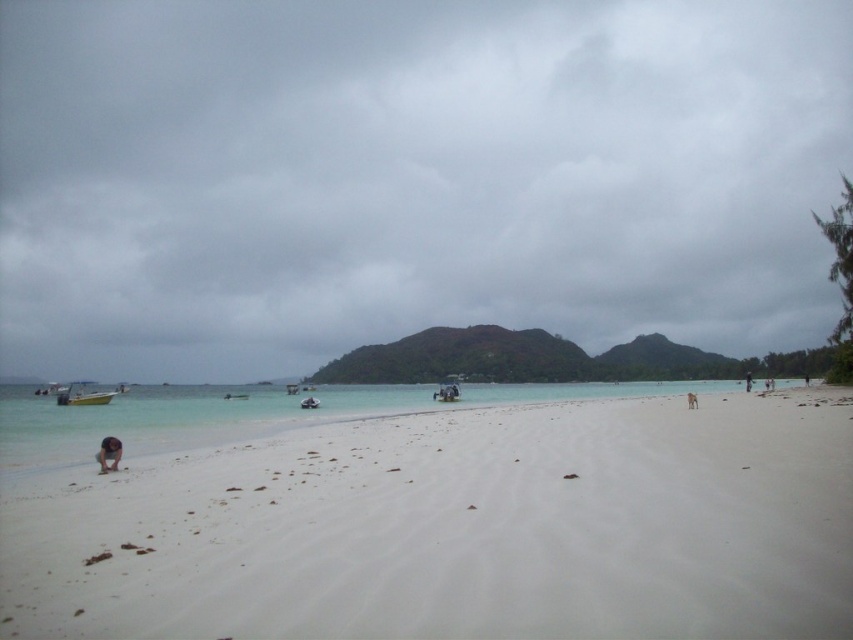
You are a lifeguard standing on the beach and need to quickly move from the white sandy beach at lower left to the brown sand at lower center. Can you make it in 5 seconds?

The distance between the white sandy beach at lower left and brown sand at lower center is 20.11 meters. To cover this distance in 5 seconds, you would need to move at a speed of at least 4.022 meters per second, which is faster than a typical walking pace but achievable through a sprint. However, the soft sand might slow you down, so it depends on your physical capability and the sand conditions.

You are standing on the beach and see two points marked on the sand. One is at point coordinates point (664,385) and the other at point (689,400). Which point is closer to you?

Point (664,385) is closer to you because it is further to the viewer than point (689,400).